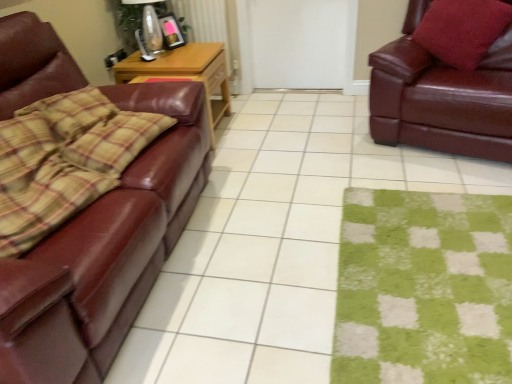
Where is `free location in front of matte glass lamp at upper center`? Image resolution: width=512 pixels, height=384 pixels. free location in front of matte glass lamp at upper center is located at coordinates (x=160, y=61).